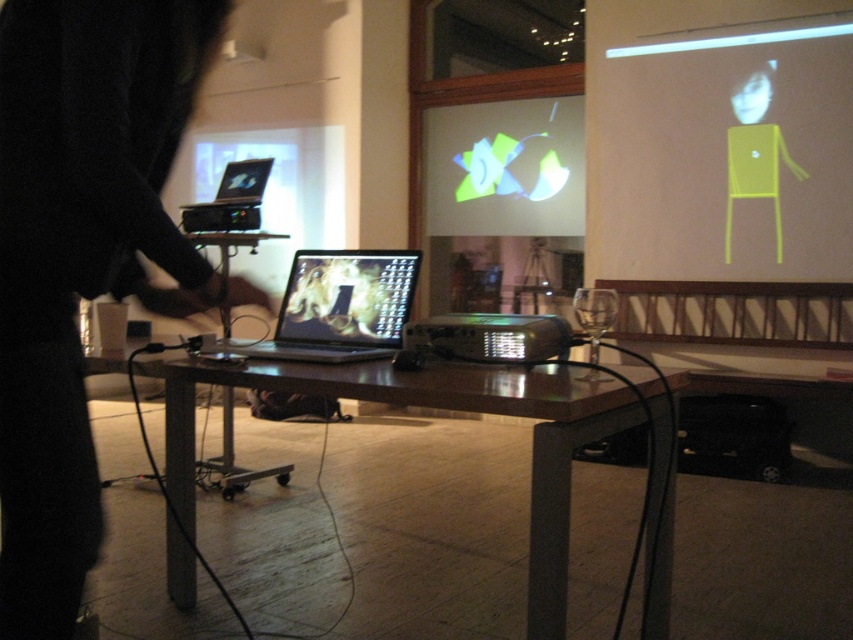
You are standing at the entrance of the room and see two points marked in the scene. The first point is at coordinates point (x=444, y=353) and the second point is at point (x=207, y=212). Which point is closer to you?

Point (x=444, y=353) is in front of point (x=207, y=212), so it is closer to you.

Based on the photo, you are setting up for a presentation and need to arrange the black plastic projector at center and the matte black laptop at upper left on a table. Given their sizes, which one should you place first to ensure they both fit on the table?

Since the black plastic projector at center takes up less space than the matte black laptop at upper left, you should place the matte black laptop at upper left first to accommodate its larger size and then position the smaller projector.